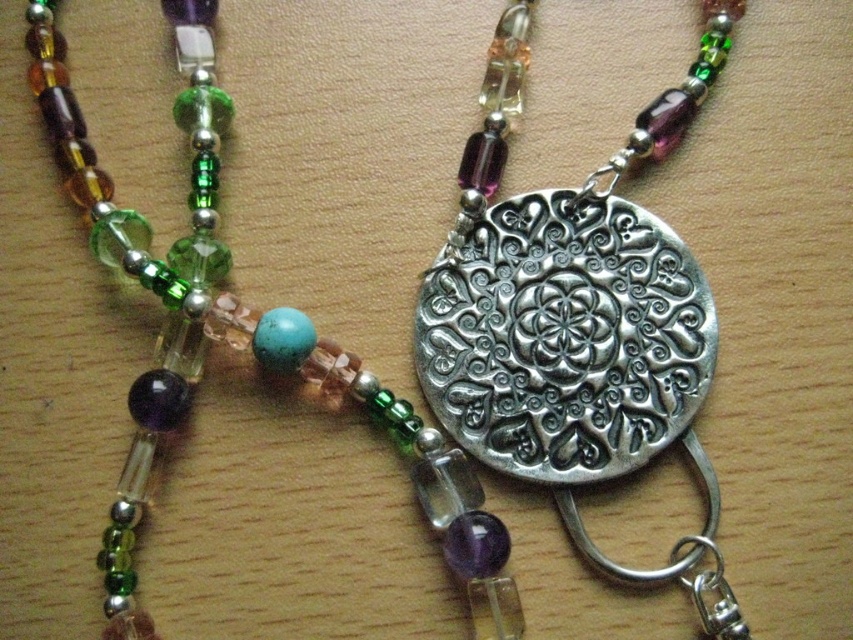
Is silver textured medallion at center bigger than matte silver medallion at center?

No, silver textured medallion at center is not bigger than matte silver medallion at center.

Does silver textured medallion at center have a greater width compared to matte silver medallion at center?

No, silver textured medallion at center is not wider than matte silver medallion at center.

Does point (596, 321) lie in front of point (444, 538)?

No.

Find the location of a particular element. The image size is (853, 640). silver textured medallion at center is located at coordinates (578, 320).